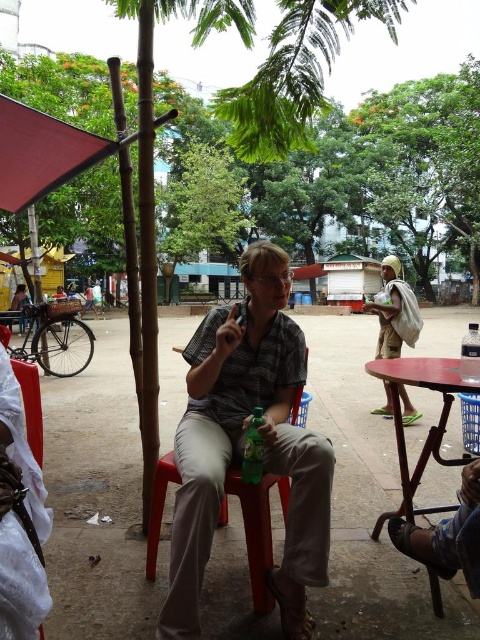
Can you confirm if matte plastic stool at center is positioned above white fabric bag at right?

No.

Can you confirm if matte plastic stool at center is wider than white fabric bag at right?

Yes, matte plastic stool at center is wider than white fabric bag at right.

Where is `matte plastic stool at center`? This screenshot has height=640, width=480. matte plastic stool at center is located at coordinates (255, 529).

From the picture: Is matte plastic stool at center closer to the viewer compared to wooden table at lower right?

Yes, it is in front of wooden table at lower right.

Does matte plastic stool at center have a larger size compared to wooden table at lower right?

No, matte plastic stool at center is not bigger than wooden table at lower right.

At what (x,y) coordinates should I click in order to perform the action: click on matte plastic stool at center. Please return your answer as a coordinate pair (x, y). This screenshot has width=480, height=640. Looking at the image, I should click on (255, 529).

Which is above, matte red canopy at upper left or wooden table at lower right?

matte red canopy at upper left is higher up.

Which of these two, matte red canopy at upper left or wooden table at lower right, stands taller?

With more height is wooden table at lower right.

This screenshot has height=640, width=480. Describe the element at coordinates (40, 154) in the screenshot. I see `matte red canopy at upper left` at that location.

Identify the location of matte red canopy at upper left. The image size is (480, 640). (40, 154).